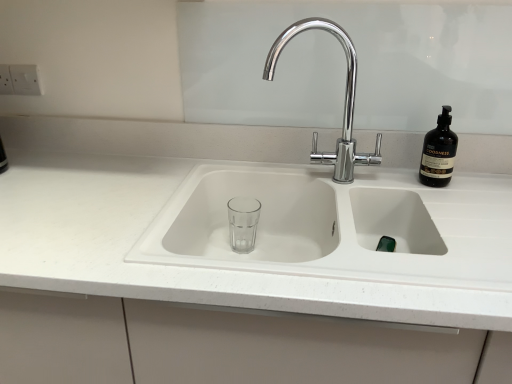
In order to click on free space to the right of dark brown glass bottle at upper right in this screenshot , I will do [x=482, y=180].